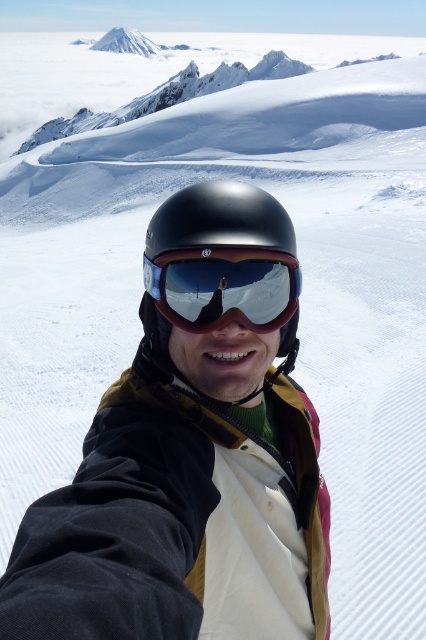
Question: Is matte black helmet at center further to camera compared to glossy reflective goggles at center?

Choices:
 (A) no
 (B) yes

Answer: (B)

Question: Is matte black helmet at center thinner than glossy reflective goggles at center?

Choices:
 (A) no
 (B) yes

Answer: (A)

Question: Which point is closer to the camera taking this photo?

Choices:
 (A) (229, 272)
 (B) (213, 301)

Answer: (A)

Question: Which object appears closest to the camera in this image?

Choices:
 (A) glossy reflective goggles at center
 (B) matte black helmet at center

Answer: (A)

Question: Can you confirm if matte black helmet at center is positioned to the left of glossy reflective goggles at center?

Choices:
 (A) yes
 (B) no

Answer: (A)